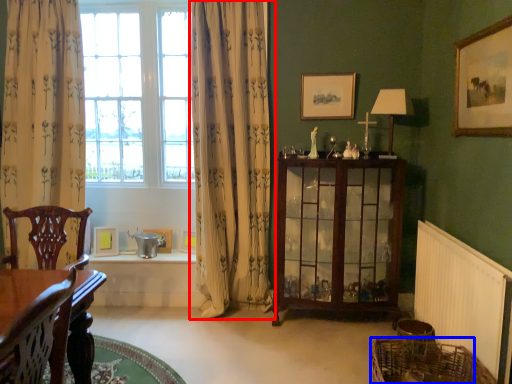
Question: Which object is further to the camera taking this photo, curtain (highlighted by a red box) or basket (highlighted by a blue box)?

Choices:
 (A) curtain
 (B) basket

Answer: (A)